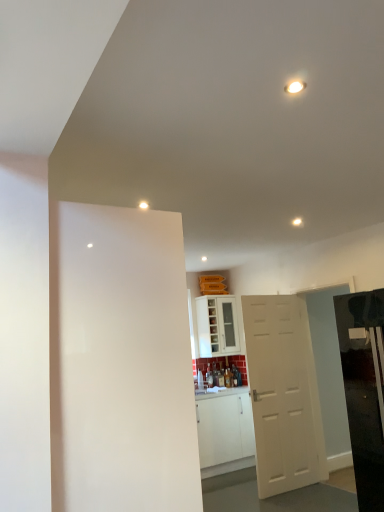
Where is `vacant region in front of white glossy light at upper center`? The image size is (384, 512). vacant region in front of white glossy light at upper center is located at coordinates (142, 201).